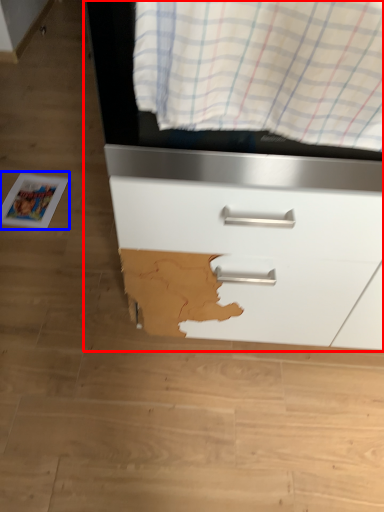
Question: Among these objects, which one is farthest to the camera, chest of drawers (highlighted by a red box) or magazine (highlighted by a blue box)?

Choices:
 (A) chest of drawers
 (B) magazine

Answer: (B)